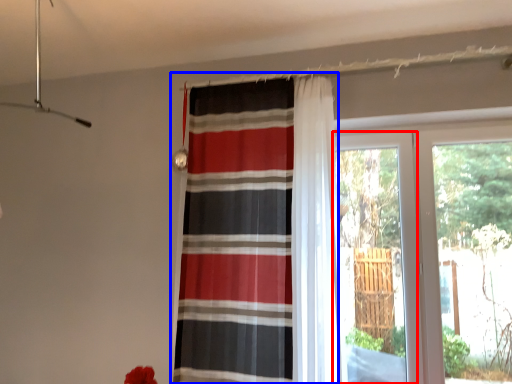
Question: Among these objects, which one is farthest to the camera, screen door (highlighted by a red box) or curtain (highlighted by a blue box)?

Choices:
 (A) screen door
 (B) curtain

Answer: (A)